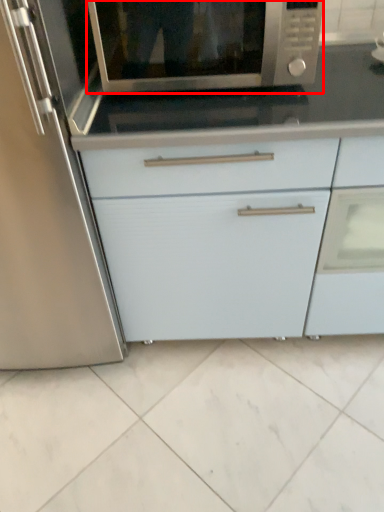
Question: From the image's perspective, where is microwave oven (annotated by the red box) located in relation to cabinetry in the image?

Choices:
 (A) above
 (B) below

Answer: (A)